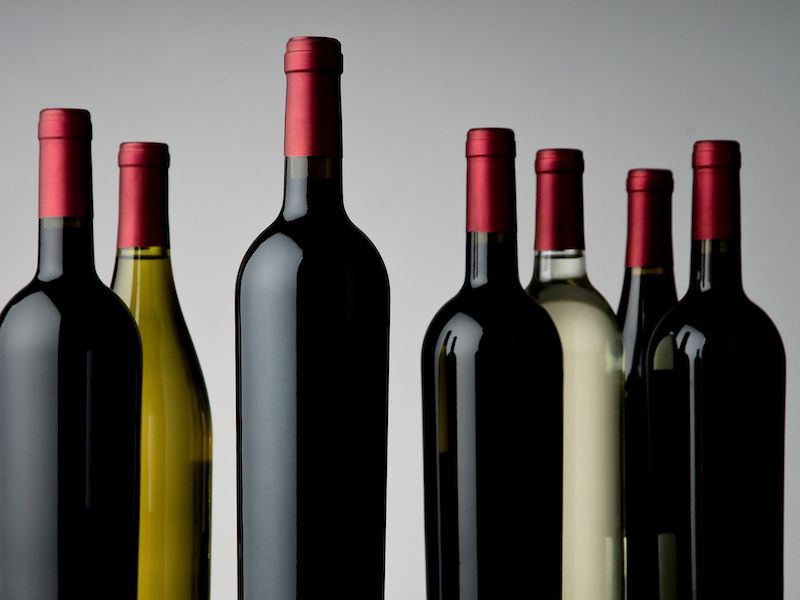
Identify the location of wine bottles. The height and width of the screenshot is (600, 800). (61, 296), (146, 299), (282, 300), (496, 338), (590, 331), (654, 313), (713, 351).